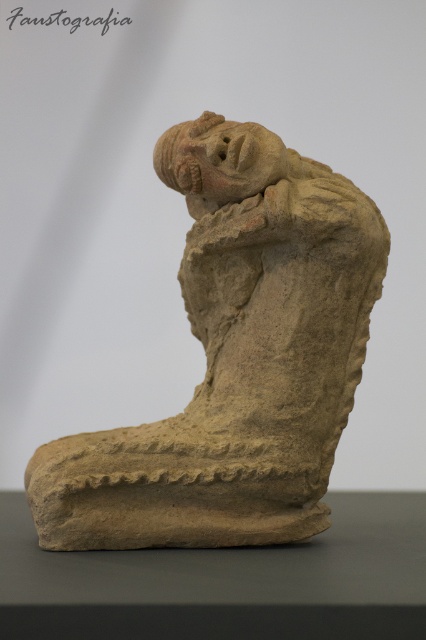
Question: Among these points, which one is nearest to the camera?

Choices:
 (A) (192, 164)
 (B) (138, 484)

Answer: (B)

Question: Which point is farther to the camera?

Choices:
 (A) (209, 150)
 (B) (206, 173)

Answer: (B)

Question: From the image, what is the correct spatial relationship of earthy clay figure at center in relation to matte clay head at center?

Choices:
 (A) right
 (B) left

Answer: (A)

Question: Is earthy clay figure at center above matte clay head at center?

Choices:
 (A) no
 (B) yes

Answer: (A)

Question: Does earthy clay figure at center appear on the left side of matte clay head at center?

Choices:
 (A) yes
 (B) no

Answer: (B)